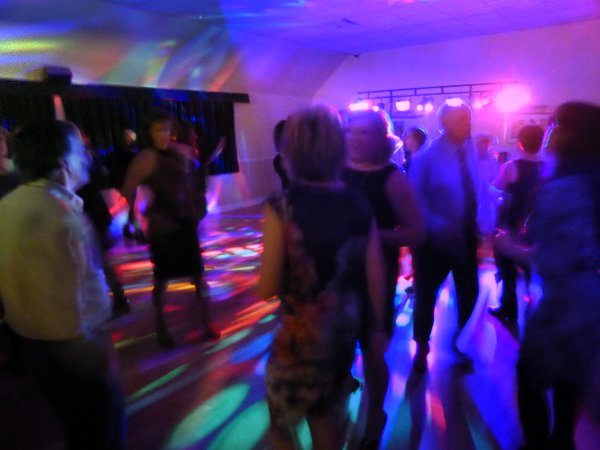
Image resolution: width=600 pixels, height=450 pixels. Identify the location of wall. (524, 45).